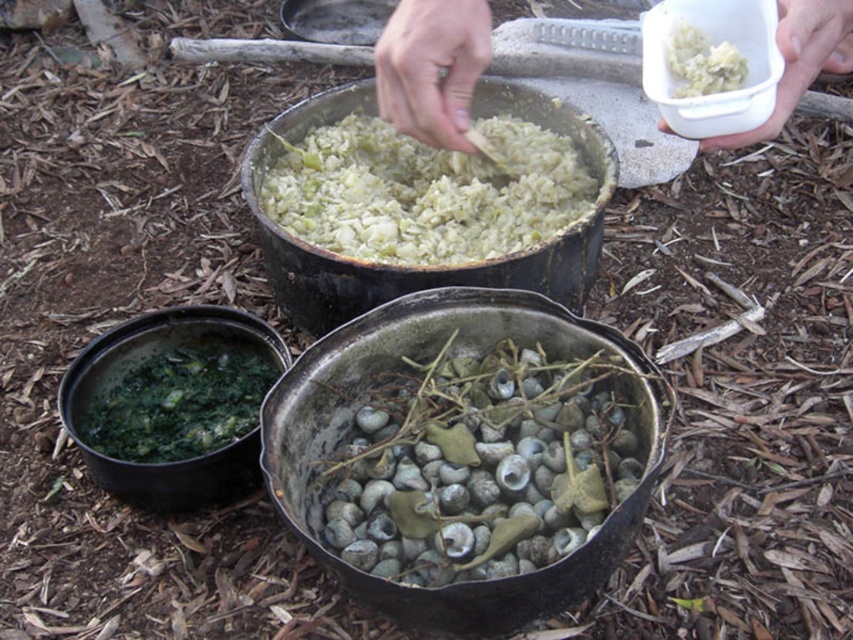
Question: Among these points, which one is nearest to the camera?

Choices:
 (A) (250, 390)
 (B) (781, 92)

Answer: (B)

Question: Which is farther from the white plastic container at upper center?

Choices:
 (A) greenish-gray shells at center
 (B) green matte rice at center
 (C) white fluffy rice at upper center
 (D) green leafy vegetable at lower left

Answer: (D)

Question: Where is greenish-gray shells at center located in relation to green leafy vegetable at lower left in the image?

Choices:
 (A) above
 (B) below

Answer: (B)

Question: Is white plastic container at upper center above white fluffy rice at upper center?

Choices:
 (A) yes
 (B) no

Answer: (A)

Question: Can you confirm if greenish-gray shells at center is wider than green matte rice at center?

Choices:
 (A) no
 (B) yes

Answer: (A)

Question: Which point is closer to the camera taking this photo?

Choices:
 (A) (405, 81)
 (B) (473, 182)
 (C) (699, 61)

Answer: (C)